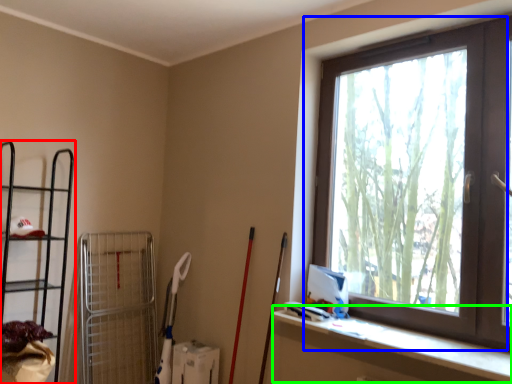
Question: Based on their relative distances, which object is farther from shelf (highlighted by a red box)? Choose from window (highlighted by a blue box) and ledge (highlighted by a green box).

Choices:
 (A) window
 (B) ledge

Answer: (A)